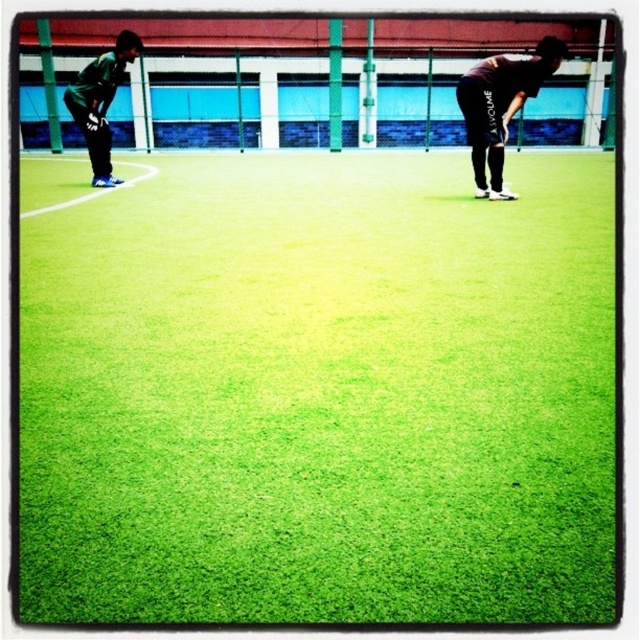
You are a referee standing on the field and need to determine the position of the two players. Based on the scene, is the player in the black matte shirt at right closer to the fence than the dark green jersey at left?

The black matte shirt at right is below dark green jersey at left, meaning it is positioned lower in the frame. Since the fence is in the background, the player in the black matte shirt at right is likely closer to the fence than the dark green jersey at left.

You are a soccer player standing on the field and you need to pass the ball to your teammate wearing the dark green jersey at left. Since the green artificial turf at center is in front of them, will you have a clear line of sight to pass the ball directly to them?

The green artificial turf at center is in front of the dark green jersey at left, so the turf is blocking the direct path. You will need to adjust your pass to go around the obstruction or use a different passing angle to reach the teammate.